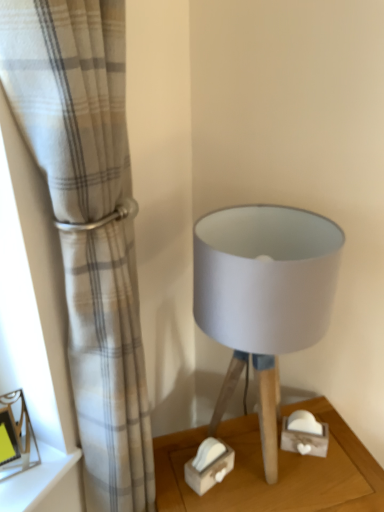
Question: Is the position of wooden tissue box at lower center more distant than that of matte white frame at lower left?

Choices:
 (A) no
 (B) yes

Answer: (B)

Question: Considering the relative sizes of wooden tissue box at lower center and matte white frame at lower left in the image provided, is wooden tissue box at lower center bigger than matte white frame at lower left?

Choices:
 (A) yes
 (B) no

Answer: (B)

Question: From the image's perspective, would you say wooden tissue box at lower center is shown under matte white frame at lower left?

Choices:
 (A) yes
 (B) no

Answer: (A)

Question: Is matte white frame at lower left at the back of wooden tissue box at lower center?

Choices:
 (A) yes
 (B) no

Answer: (B)

Question: Would you say wooden tissue box at lower center is a long distance from matte white frame at lower left?

Choices:
 (A) no
 (B) yes

Answer: (A)

Question: Considering the positions of metallic gold picture frame at lower left and matte gray fabric lampshade at center in the image, is metallic gold picture frame at lower left bigger or smaller than matte gray fabric lampshade at center?

Choices:
 (A) big
 (B) small

Answer: (B)

Question: Is metallic gold picture frame at lower left in front of or behind matte gray fabric lampshade at center in the image?

Choices:
 (A) behind
 (B) front

Answer: (A)

Question: Is point (3, 416) closer or farther from the camera than point (226, 378)?

Choices:
 (A) farther
 (B) closer

Answer: (B)

Question: Considering the positions of metallic gold picture frame at lower left and matte gray fabric lampshade at center in the image, is metallic gold picture frame at lower left wider or thinner than matte gray fabric lampshade at center?

Choices:
 (A) wide
 (B) thin

Answer: (B)

Question: In terms of height, does matte white frame at lower left look taller or shorter compared to metallic gold picture frame at lower left?

Choices:
 (A) short
 (B) tall

Answer: (A)

Question: Does point (41, 452) appear closer or farther from the camera than point (18, 450)?

Choices:
 (A) farther
 (B) closer

Answer: (A)

Question: Looking at their shapes, would you say matte white frame at lower left is wider or thinner than metallic gold picture frame at lower left?

Choices:
 (A) wide
 (B) thin

Answer: (A)

Question: Considering their positions, is matte white frame at lower left located in front of or behind metallic gold picture frame at lower left?

Choices:
 (A) front
 (B) behind

Answer: (B)

Question: Relative to wooden tissue box at lower center, is white textured curtain at left in front or behind?

Choices:
 (A) front
 (B) behind

Answer: (A)

Question: From the image's perspective, is white textured curtain at left positioned above or below wooden tissue box at lower center?

Choices:
 (A) below
 (B) above

Answer: (B)